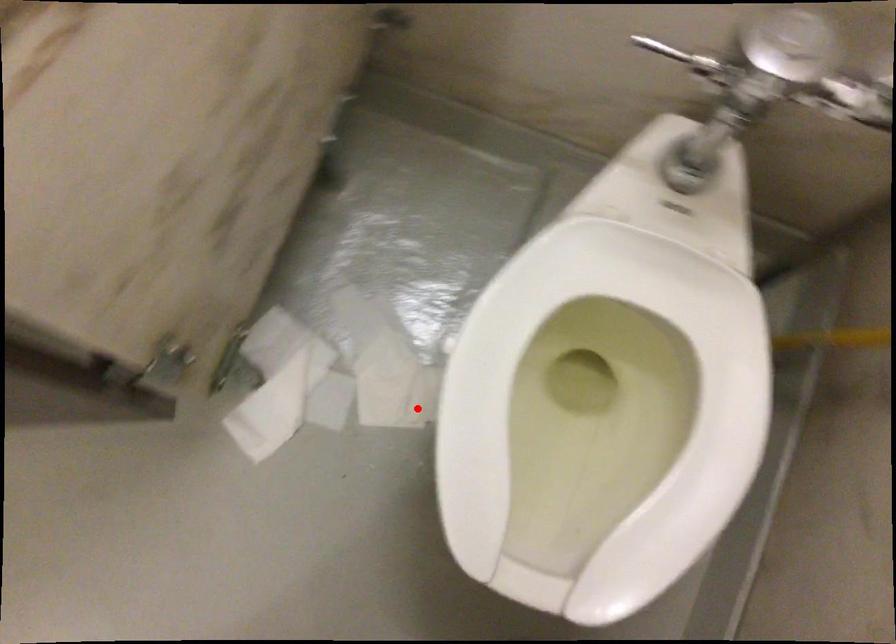
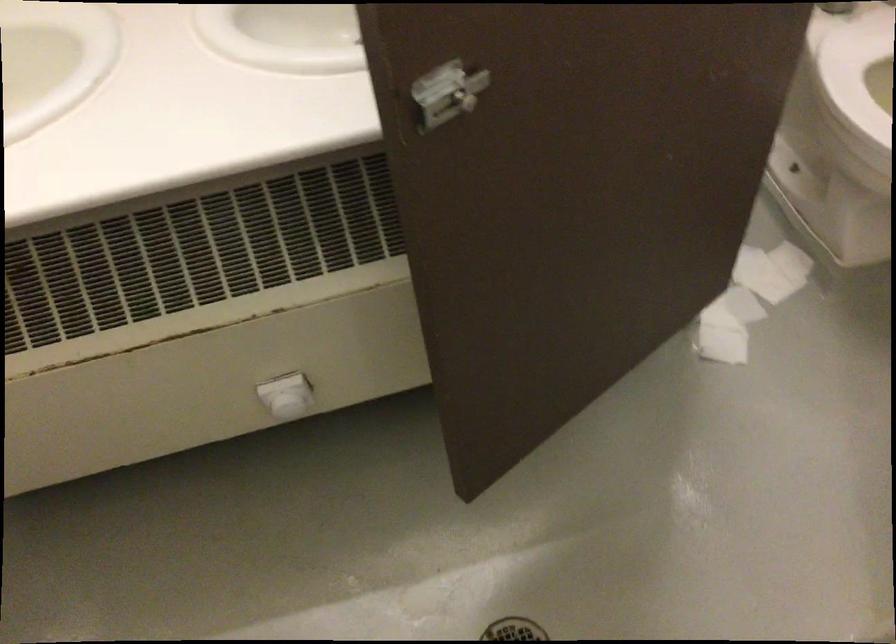
Question: I am providing you with two images of the same scene from different viewpoints. Image1 has a red point marked. In image2, the corresponding 3D location appears at what relative position? Reply with the corresponding letter.

Choices:
 (A) Closer
 (B) Farther

Answer: (B)